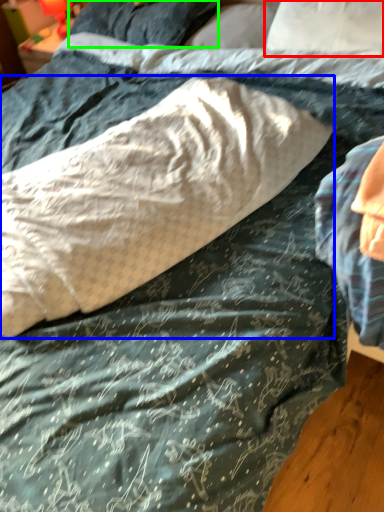
Question: Based on their relative distances, which object is farther from pillow (highlighted by a red box)? Choose from pillow (highlighted by a blue box) and pillow (highlighted by a green box).

Choices:
 (A) pillow
 (B) pillow

Answer: (A)